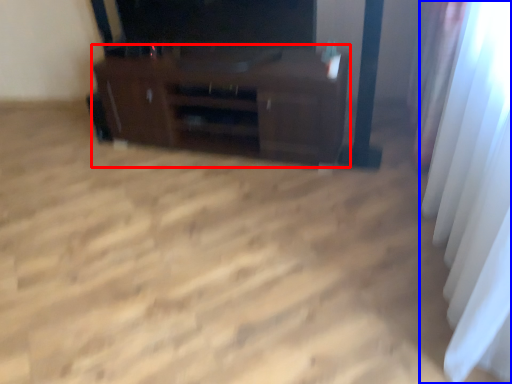
Question: Among these objects, which one is nearest to the camera, furniture (highlighted by a red box) or curtain (highlighted by a blue box)?

Choices:
 (A) furniture
 (B) curtain

Answer: (B)